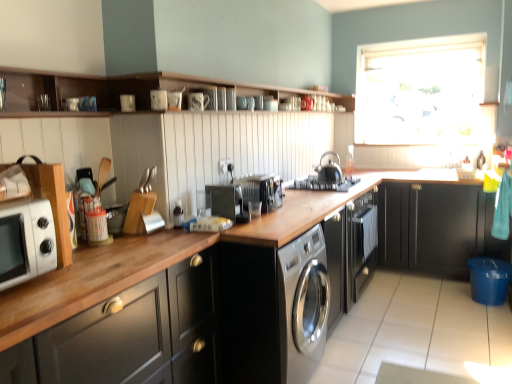
Find the location of a particular element. The width and height of the screenshot is (512, 384). free space above matte wood cabinet at left, the 1th cabinetry from the bottom (from a real-world perspective) is located at coordinates (92, 264).